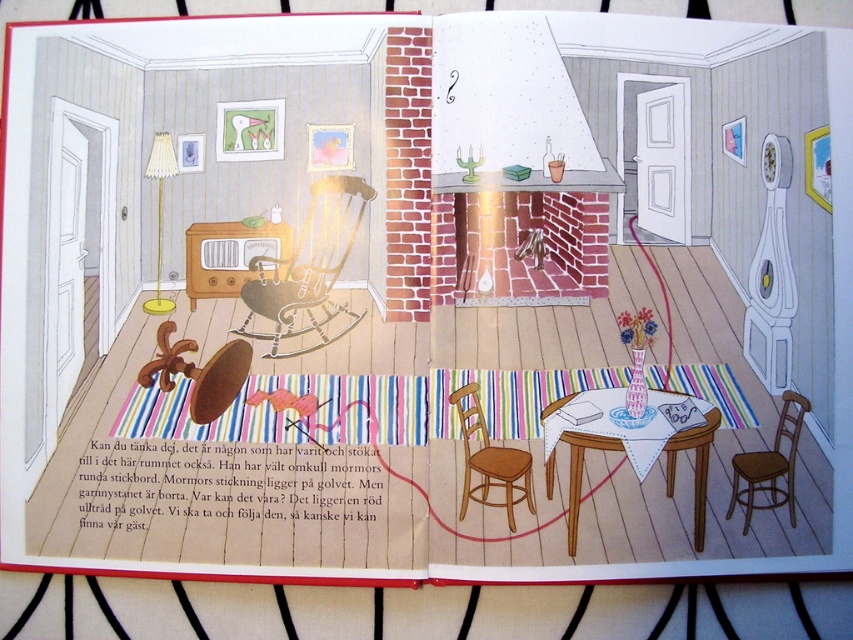
Question: Can you confirm if metallic silver rocking chair at center is bigger than wooden chair at lower right?

Choices:
 (A) no
 (B) yes

Answer: (B)

Question: Estimate the real-world distances between objects in this image. Which object is closer to the white cloth-covered table at center?

Choices:
 (A) white paper at center
 (B) wooden chair at center
 (C) white paper book at center

Answer: (C)

Question: Does wooden chair at center have a smaller size compared to white paper at center?

Choices:
 (A) yes
 (B) no

Answer: (B)

Question: Which object is farther from the camera taking this photo?

Choices:
 (A) white paper book at center
 (B) wooden chair at lower right
 (C) wooden chair at center

Answer: (B)

Question: Considering the real-world distances, which object is closest to the white paper at center?

Choices:
 (A) wooden chair at lower right
 (B) wooden chair at center
 (C) white paper book at center

Answer: (C)

Question: Does metallic silver rocking chair at center appear on the right side of white paper book at center?

Choices:
 (A) no
 (B) yes

Answer: (A)